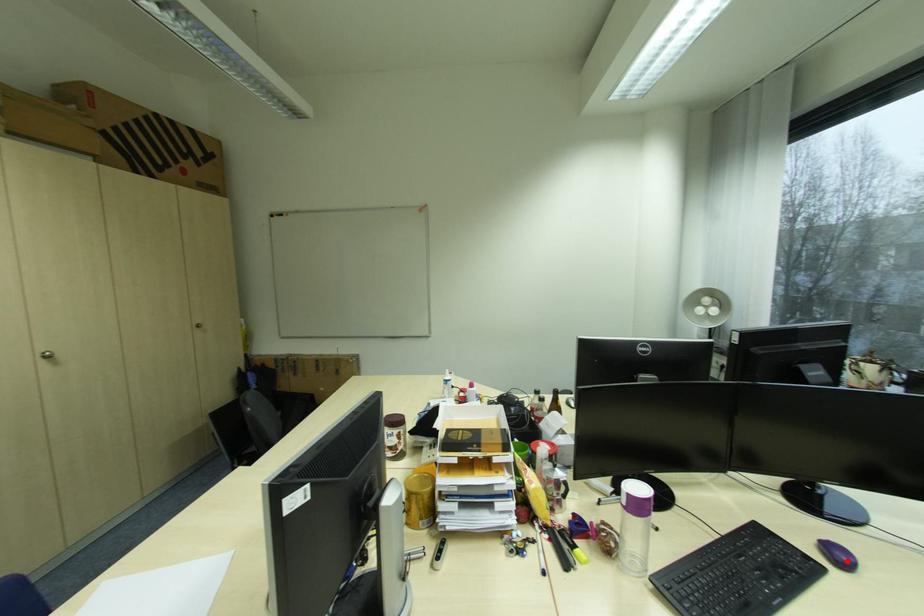
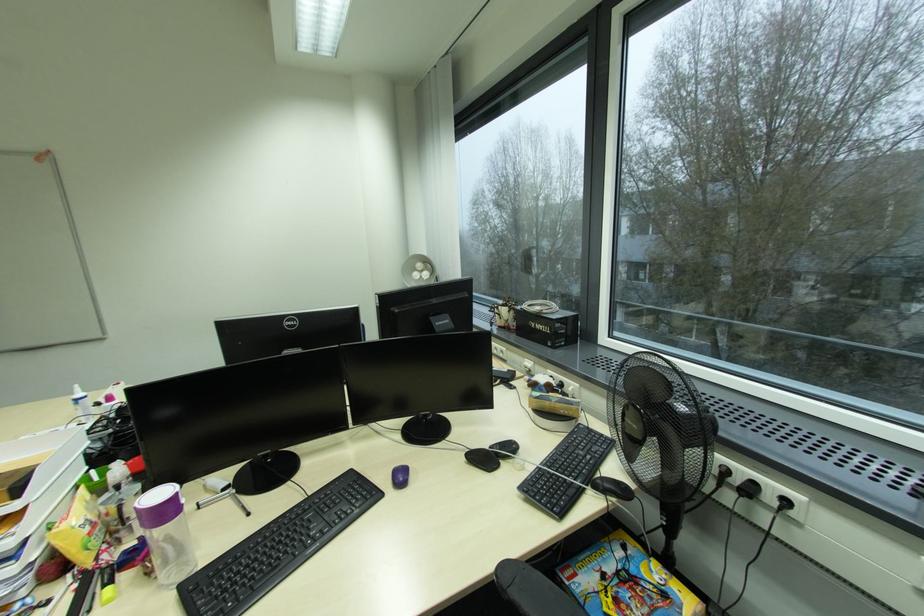
Where in the second image is the point corresponding to the highlighted location from the first image?

(405, 483)